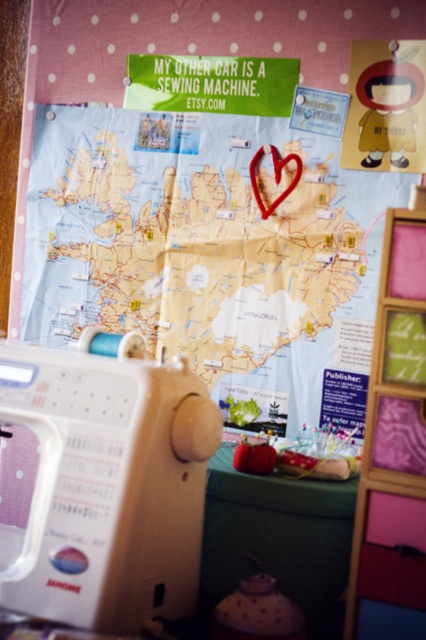
Based on the photo, you are standing in front of the workspace and want to place a small sticker on the point that is closer to you. Which point should you choose between point [131,568] and point [232,541]?

You should choose point [131,568] because it is closer to you than point [232,541].